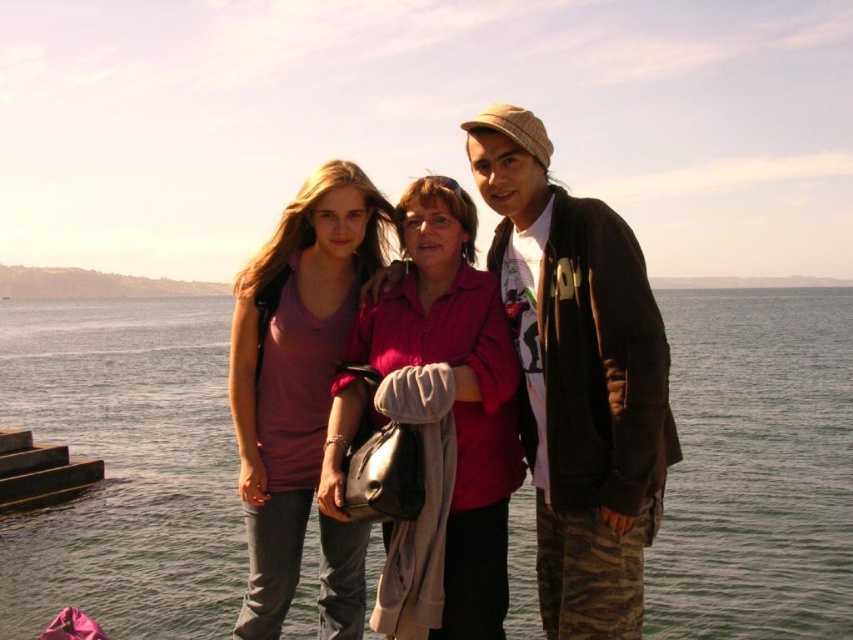
Question: Can you confirm if camouflage pants at right is positioned to the right of matte purple shirt at center?

Choices:
 (A) yes
 (B) no

Answer: (A)

Question: Does pink matte shirt at center appear over camouflage pants at right?

Choices:
 (A) yes
 (B) no

Answer: (A)

Question: Does camouflage pants at right lie behind matte purple shirt at center?

Choices:
 (A) no
 (B) yes

Answer: (A)

Question: Which point is farther from the camera taking this photo?

Choices:
 (A) (549, 531)
 (B) (222, 554)
 (C) (465, 632)
 (D) (355, 525)

Answer: (B)

Question: Which point is farther from the camera taking this photo?

Choices:
 (A) (610, 628)
 (B) (457, 240)

Answer: (B)

Question: Which object appears closest to the camera in this image?

Choices:
 (A) pink matte shirt at center
 (B) camouflage pants at right

Answer: (B)